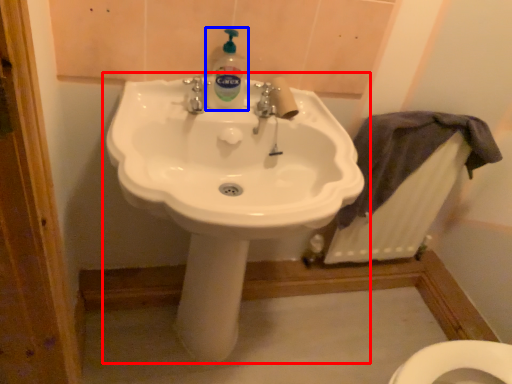
Question: Which object is further to the camera taking this photo, sink (highlighted by a red box) or cleaning product (highlighted by a blue box)?

Choices:
 (A) sink
 (B) cleaning product

Answer: (B)